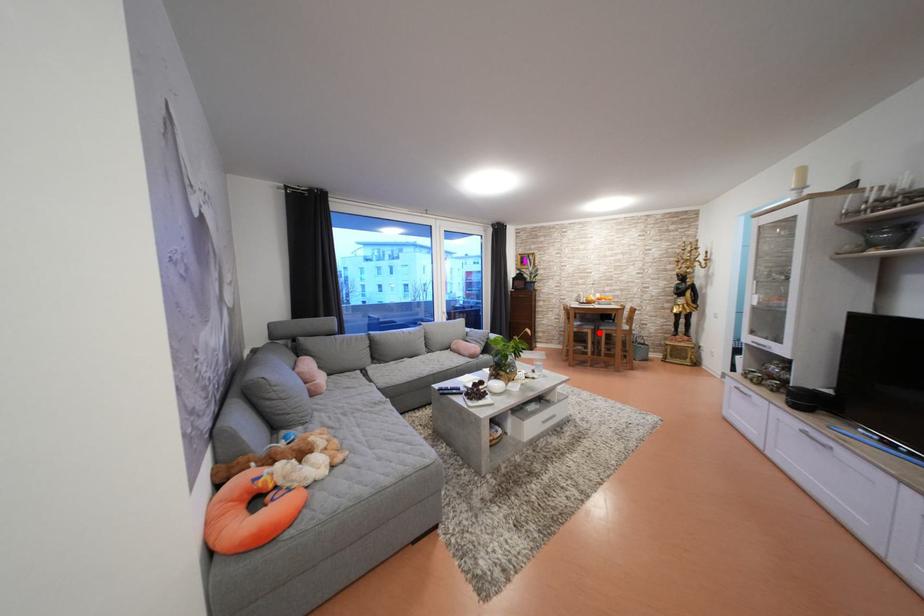
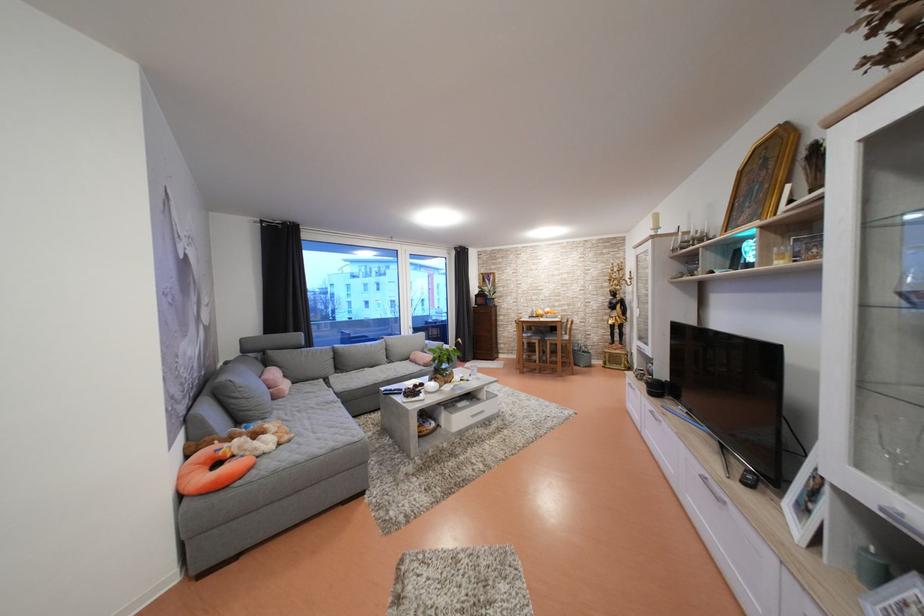
Question: I am providing you with two images of the same scene from different viewpoints. A red point is shown in image1. For the corresponding object point in image2, is it positioned nearer or farther from the camera?

Choices:
 (A) Nearer
 (B) Farther

Answer: (A)